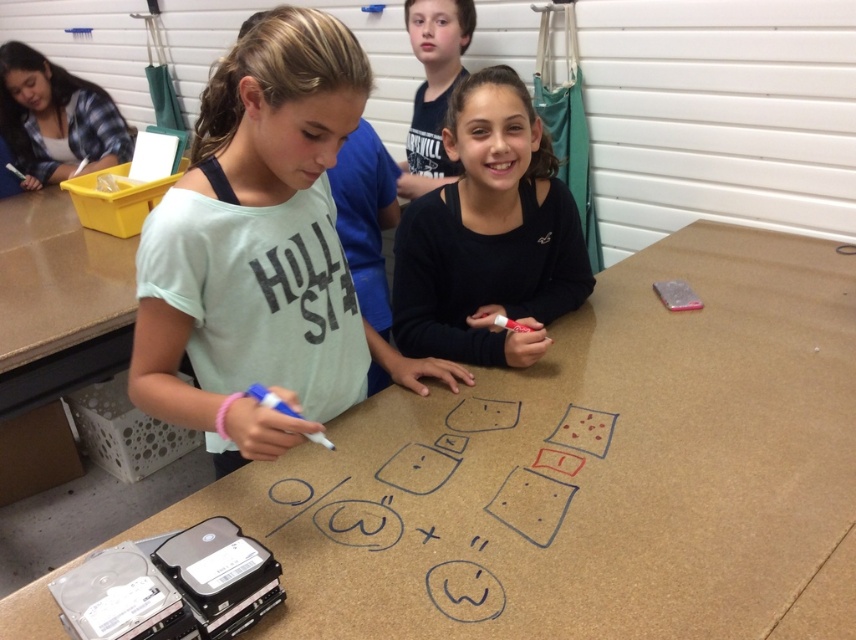
What object is located at the coordinates point (592, 472) in the classroom scene?

The point (592, 472) corresponds to the brown matte table at center.

Looking at this image, you are a photographer trying to capture a clear shot of the light green cotton shirt at center and the black matte shirt at center. Which shirt should you focus on to ensure the other remains in the background?

You should focus on the light green cotton shirt at center because it is in front of the black matte shirt at center, so focusing on it will keep the black matte shirt at center in the background.

You are a photographer trying to capture a closeup of the light green cotton shirt at center and the black matte shirt at center. Since you want to focus on the one that is taller, which shirt should you zoom in on?

Answer: The light green cotton shirt at center is taller than the black matte shirt at center, so you should zoom in on the light green cotton shirt at center.